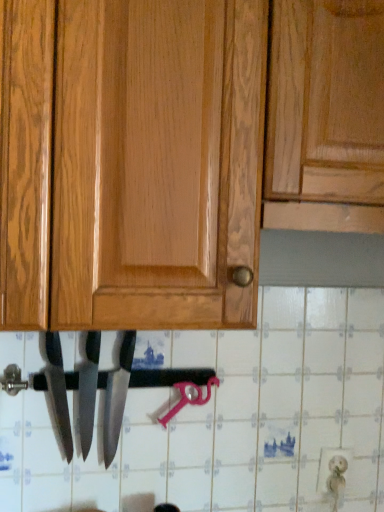
Question: Which direction should I rotate to look at polished silver knife at lower center, acting as the 1th knife starting from the left?

Choices:
 (A) right
 (B) left

Answer: (B)

Question: From the image's perspective, is polished silver knife at lower center, acting as the third knife starting from the right, above polished silver knife at center, which is counted as the 2th knife, starting from the right?

Choices:
 (A) yes
 (B) no

Answer: (A)

Question: Is polished silver knife at lower center, acting as the 1th knife starting from the left, not near polished silver knife at center, which is the second knife in left-to-right order?

Choices:
 (A) no
 (B) yes

Answer: (A)

Question: Does polished silver knife at lower center, acting as the 1th knife starting from the left, touch polished silver knife at center, which is counted as the 2th knife, starting from the right?

Choices:
 (A) no
 (B) yes

Answer: (B)

Question: Is polished silver knife at lower center, acting as the third knife starting from the right, shorter than polished silver knife at center, which is the second knife in left-to-right order?

Choices:
 (A) yes
 (B) no

Answer: (A)

Question: Considering the relative sizes of polished silver knife at lower center, acting as the third knife starting from the right, and polished silver knife at center, which is the second knife in left-to-right order, in the image provided, is polished silver knife at lower center, acting as the third knife starting from the right, wider than polished silver knife at center, which is the second knife in left-to-right order,?

Choices:
 (A) yes
 (B) no

Answer: (A)

Question: Can you confirm if polished silver knife at lower center, acting as the third knife starting from the right, is positioned to the right of polished silver knife at center, which is counted as the 2th knife, starting from the right?

Choices:
 (A) no
 (B) yes

Answer: (A)

Question: Is polished silver knife at center, which is the second knife in left-to-right order, at the right side of polished silver knife at center, positioned as the 3th knife in left-to-right order?

Choices:
 (A) yes
 (B) no

Answer: (B)

Question: Is polished silver knife at center, which is the second knife in left-to-right order, to the left of polished silver knife at center, the first knife positioned from the right, from the viewer's perspective?

Choices:
 (A) no
 (B) yes

Answer: (B)

Question: Can you see polished silver knife at center, which is counted as the 2th knife, starting from the right, touching polished silver knife at center, positioned as the 3th knife in left-to-right order?

Choices:
 (A) yes
 (B) no

Answer: (A)

Question: Considering the relative sizes of polished silver knife at center, which is counted as the 2th knife, starting from the right, and polished silver knife at center, positioned as the 3th knife in left-to-right order, in the image provided, is polished silver knife at center, which is counted as the 2th knife, starting from the right, taller than polished silver knife at center, positioned as the 3th knife in left-to-right order,?

Choices:
 (A) no
 (B) yes

Answer: (A)

Question: Is polished silver knife at center, which is the second knife in left-to-right order, further to camera compared to polished silver knife at center, positioned as the 3th knife in left-to-right order?

Choices:
 (A) no
 (B) yes

Answer: (B)

Question: Considering the relative sizes of polished silver knife at center, which is counted as the 2th knife, starting from the right, and polished silver knife at center, the first knife positioned from the right, in the image provided, is polished silver knife at center, which is counted as the 2th knife, starting from the right, shorter than polished silver knife at center, the first knife positioned from the right,?

Choices:
 (A) yes
 (B) no

Answer: (A)

Question: From the image's perspective, is polished silver knife at center, positioned as the 3th knife in left-to-right order, beneath polished silver knife at center, which is the second knife in left-to-right order?

Choices:
 (A) yes
 (B) no

Answer: (A)